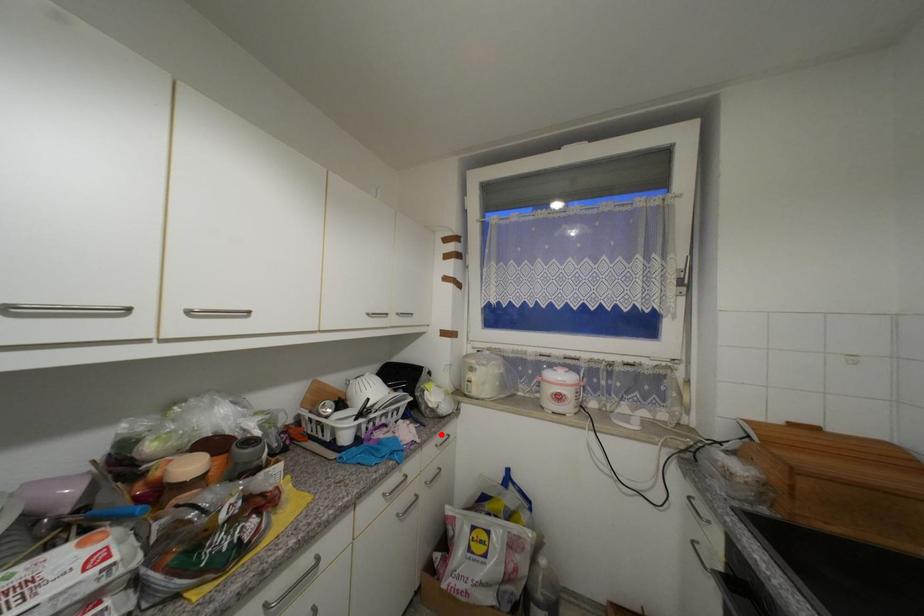
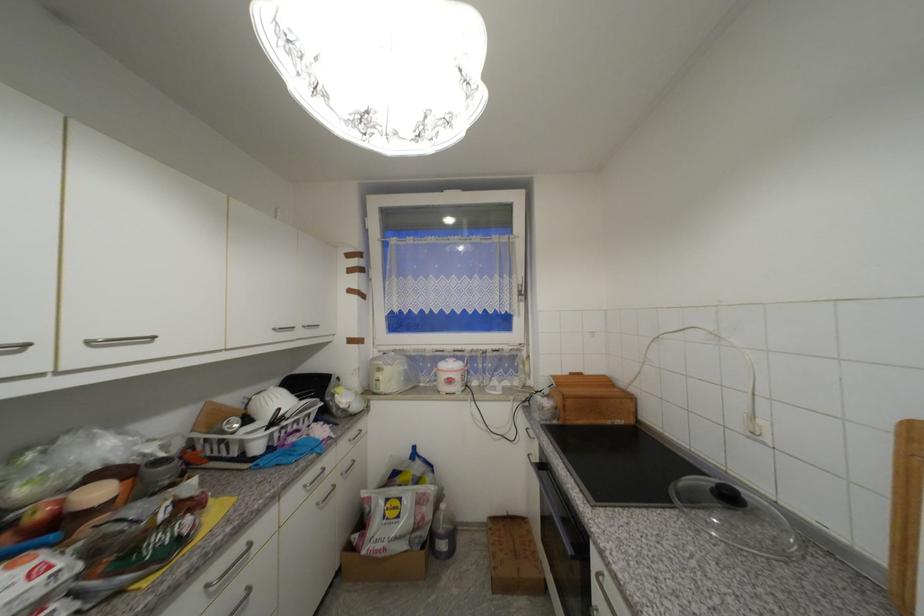
Locate, in the second image, the point that corresponds to the highlighted location in the first image.

(354, 430)